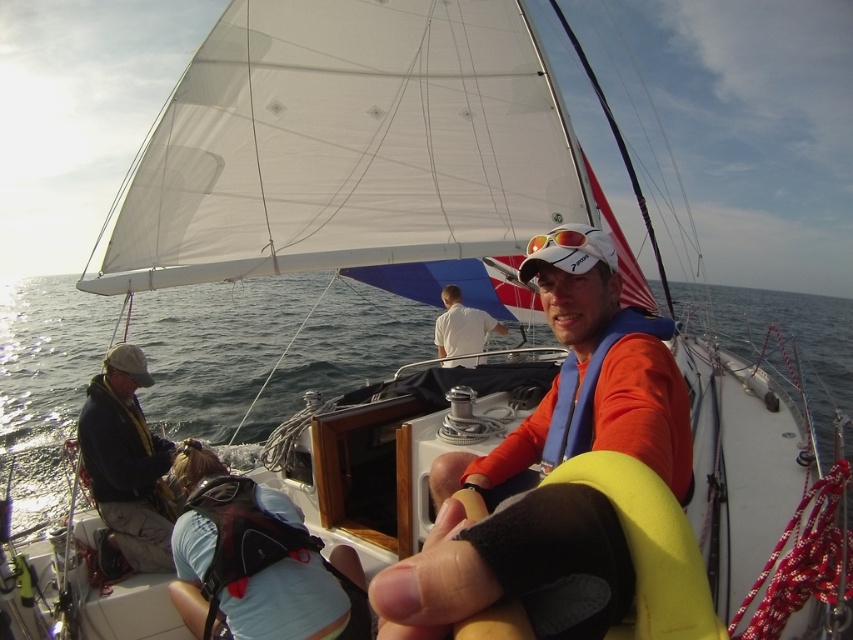
Question: In this image, where is orange fabric life vest at center located relative to dark blue fabric jacket at left?

Choices:
 (A) below
 (B) above

Answer: (B)

Question: Based on their relative distances, which object is farther from the orange fabric life vest at center?

Choices:
 (A) light blue fabric at lower center
 (B) dark blue fabric jacket at left
 (C) white cotton shirt at center

Answer: (C)

Question: Which object appears farthest from the camera in this image?

Choices:
 (A) light blue fabric at lower center
 (B) white cotton shirt at center
 (C) orange fabric life vest at center
 (D) dark blue fabric jacket at left

Answer: (B)

Question: Which point is farther to the camera?

Choices:
 (A) light blue fabric at lower center
 (B) orange fabric life vest at center
 (C) dark blue fabric jacket at left

Answer: (C)

Question: Is light blue fabric at lower center behind dark blue fabric jacket at left?

Choices:
 (A) yes
 (B) no

Answer: (B)

Question: Is orange fabric life vest at center below white cotton shirt at center?

Choices:
 (A) no
 (B) yes

Answer: (A)